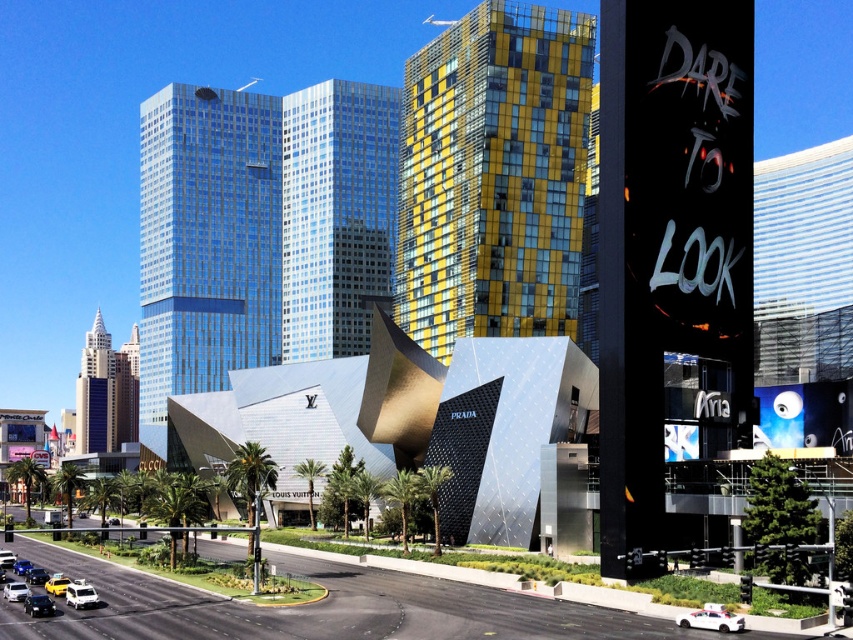
Question: Does yellow glass building at center appear under glassy blue skyscraper at center-left?

Choices:
 (A) no
 (B) yes

Answer: (A)

Question: Estimate the real-world distances between objects in this image. Which object is farther from the white matte van at lower left?

Choices:
 (A) white matte car at lower left
 (B) yellow matte taxi cab at center

Answer: (B)

Question: Which point is closer to the camera?

Choices:
 (A) (181, 173)
 (B) (351, 244)

Answer: (B)

Question: Does white glossy sedan at lower left come in front of shiny black sedan at lower left?

Choices:
 (A) yes
 (B) no

Answer: (A)

Question: Which object is positioned closest to the blue glass skyscraper at left?

Choices:
 (A) white glossy car at lower left
 (B) yellow matte taxi cab at lower left
 (C) white matte van at lower left

Answer: (A)

Question: Does yellow glass building at center appear on the right side of white glossy car at lower center?

Choices:
 (A) no
 (B) yes

Answer: (A)